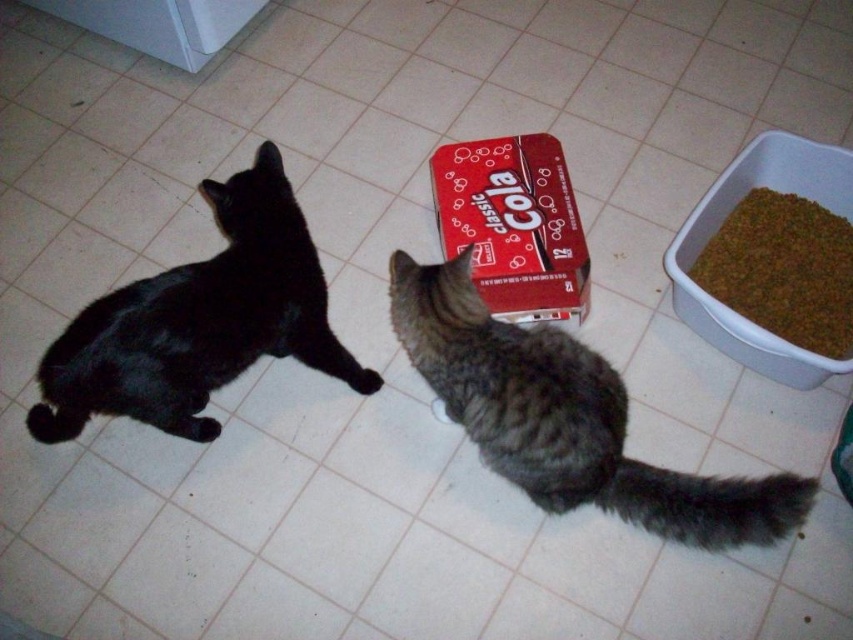
You are a delivery robot that needs to place a small package between the gray striped fur cat at center and the matte black cat at left. Can you fit the package between them if the package is 1 meter wide?

The gray striped fur cat at center might be wider than matte black cat at left, but without knowing the exact width of the space between them, it is uncertain if the 1 meter wide package can fit. More information is needed to determine this.

You are a robotic vacuum cleaner with a diameter of 12 inches. You are currently positioned to the left of the matte black cat at left and want to move to the brown granular food at right. Can you navigate the space between the two objects without hitting either?

The distance between the matte black cat at left and the brown granular food at right is 34.60 inches. Since the robotic vacuum cleaner has a diameter of 12 inches, it can easily navigate the space between them as the gap is sufficiently wide. Therefore, the robotic vacuum can move from the matte black cat at left to the brown granular food at right without any issues.